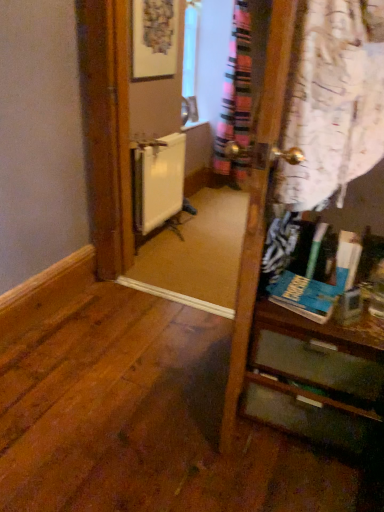
Find the location of a particular element. The image size is (384, 512). matte wooden vanity at right is located at coordinates (315, 378).

Measure the distance between matte wooden vanity at right and camera.

A distance of 1.31 meters exists between matte wooden vanity at right and camera.

The width and height of the screenshot is (384, 512). Describe the element at coordinates (315, 378) in the screenshot. I see `matte wooden vanity at right` at that location.

This screenshot has width=384, height=512. Describe the element at coordinates (157, 181) in the screenshot. I see `white matte radiator at center` at that location.

The width and height of the screenshot is (384, 512). Identify the location of white matte radiator at center. (157, 181).

Where is `matte wooden vanity at right`? Image resolution: width=384 pixels, height=512 pixels. matte wooden vanity at right is located at coordinates (315, 378).

Which object is positioned more to the left, white matte radiator at center or matte wooden vanity at right?

white matte radiator at center is more to the left.

Is the depth of white matte radiator at center less than that of matte wooden vanity at right?

That is False.

Is point (161, 161) closer to viewer compared to point (269, 304)?

No.

From the image's perspective, which one is positioned lower, white matte radiator at center or matte wooden vanity at right?

matte wooden vanity at right is shown below in the image.

From a real-world perspective, is white matte radiator at center physically above matte wooden vanity at right?

Yes, from a real-world perspective, white matte radiator at center is on top of matte wooden vanity at right.

Considering the relative sizes of white matte radiator at center and matte wooden vanity at right in the image provided, is white matte radiator at center thinner than matte wooden vanity at right?

Correct, the width of white matte radiator at center is less than that of matte wooden vanity at right.

Between white matte radiator at center and matte wooden vanity at right, which one has less height?

Standing shorter between the two is matte wooden vanity at right.

Who is bigger, white matte radiator at center or matte wooden vanity at right?

matte wooden vanity at right.

Is white matte radiator at center positioned beyond the bounds of matte wooden vanity at right?

white matte radiator at center is positioned outside matte wooden vanity at right.

Are white matte radiator at center and matte wooden vanity at right located far from each other?

Absolutely, white matte radiator at center is distant from matte wooden vanity at right.

Is white matte radiator at center turned away from matte wooden vanity at right?

No, white matte radiator at center is not facing away from matte wooden vanity at right.

Where is `radiator positioned vertically above the matte wooden vanity at right (from a real-world perspective)`? This screenshot has width=384, height=512. radiator positioned vertically above the matte wooden vanity at right (from a real-world perspective) is located at coordinates (157, 181).

Between matte wooden vanity at right and white matte radiator at center, which one appears on the right side from the viewer's perspective?

matte wooden vanity at right.

Is matte wooden vanity at right behind white matte radiator at center?

No.

Is point (353, 353) closer or farther from the camera than point (166, 145)?

Point (353, 353) appears to be closer to the viewer than point (166, 145).

From the image's perspective, which one is positioned higher, matte wooden vanity at right or white matte radiator at center?

white matte radiator at center appears higher in the image.

From a real-world perspective, relative to white matte radiator at center, is matte wooden vanity at right vertically above or below?

matte wooden vanity at right is situated lower than white matte radiator at center in the real world.

In terms of width, does matte wooden vanity at right look wider or thinner when compared to white matte radiator at center?

In the image, matte wooden vanity at right appears to be wider than white matte radiator at center.

Considering the sizes of objects matte wooden vanity at right and white matte radiator at center in the image provided, who is shorter, matte wooden vanity at right or white matte radiator at center?

Standing shorter between the two is matte wooden vanity at right.

Who is smaller, matte wooden vanity at right or white matte radiator at center?

With smaller size is white matte radiator at center.

Could white matte radiator at center be considered to be inside matte wooden vanity at right?

No.

Is matte wooden vanity at right with white matte radiator at center?

No, matte wooden vanity at right is not next to white matte radiator at center.

In the scene shown: Is white matte radiator at center at the back of matte wooden vanity at right?

matte wooden vanity at right does not have its back to white matte radiator at center.

Image resolution: width=384 pixels, height=512 pixels. I want to click on vanity below the white matte radiator at center (from a real-world perspective), so click(x=315, y=378).

The height and width of the screenshot is (512, 384). I want to click on vanity that is in front of the white matte radiator at center, so pyautogui.click(x=315, y=378).

The width and height of the screenshot is (384, 512). In order to click on vanity that appears on the right of white matte radiator at center in this screenshot , I will do `click(315, 378)`.